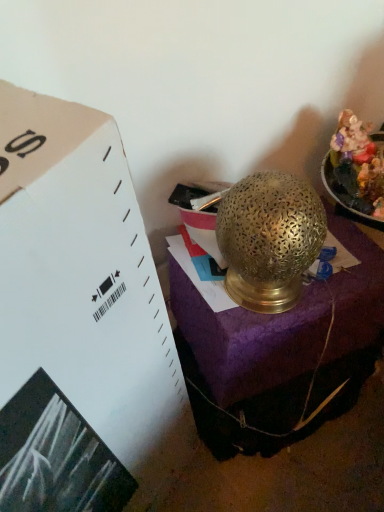
Question: Should I look upward or downward to see gold textured lamp at center?

Choices:
 (A) down
 (B) up

Answer: (B)

Question: Can you confirm if gold textured lamp at center is thinner than gold textured lamp at center?

Choices:
 (A) yes
 (B) no

Answer: (B)

Question: Is gold textured lamp at center aimed at gold textured lamp at center?

Choices:
 (A) yes
 (B) no

Answer: (B)

Question: From a real-world perspective, is gold textured lamp at center below gold textured lamp at center?

Choices:
 (A) no
 (B) yes

Answer: (B)

Question: From the image's perspective, would you say gold textured lamp at center is positioned over gold textured lamp at center?

Choices:
 (A) yes
 (B) no

Answer: (B)

Question: Is gold textured lamp at center at the left side of gold textured lamp at center?

Choices:
 (A) yes
 (B) no

Answer: (B)

Question: Would you say gold textured lamp at center contains gold textured lamp at center?

Choices:
 (A) no
 (B) yes

Answer: (B)

Question: Can you confirm if shiny metallic food at upper right is shorter than gold textured lamp at center?

Choices:
 (A) yes
 (B) no

Answer: (A)

Question: Is shiny metallic food at upper right wider than gold textured lamp at center?

Choices:
 (A) yes
 (B) no

Answer: (A)

Question: Is shiny metallic food at upper right at the left side of gold textured lamp at center?

Choices:
 (A) yes
 (B) no

Answer: (B)

Question: Is the position of shiny metallic food at upper right more distant than that of gold textured lamp at center?

Choices:
 (A) yes
 (B) no

Answer: (B)

Question: Is shiny metallic food at upper right beside gold textured lamp at center?

Choices:
 (A) yes
 (B) no

Answer: (B)

Question: Is the depth of shiny metallic food at upper right less than that of gold textured lamp at center?

Choices:
 (A) yes
 (B) no

Answer: (A)

Question: Considering the relative positions of gold textured lamp at center and shiny metallic food at upper right in the image provided, is gold textured lamp at center to the left of shiny metallic food at upper right from the viewer's perspective?

Choices:
 (A) no
 (B) yes

Answer: (B)